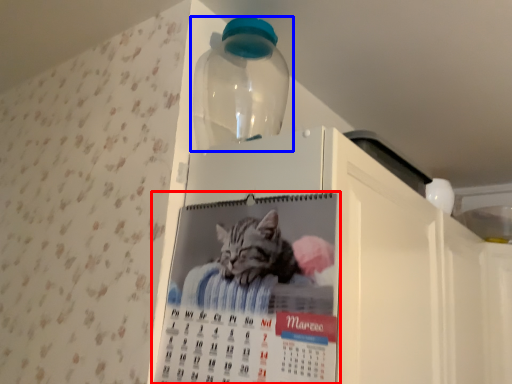
Question: Among these objects, which one is nearest to the camera, poster (highlighted by a red box) or bottle (highlighted by a blue box)?

Choices:
 (A) poster
 (B) bottle

Answer: (A)